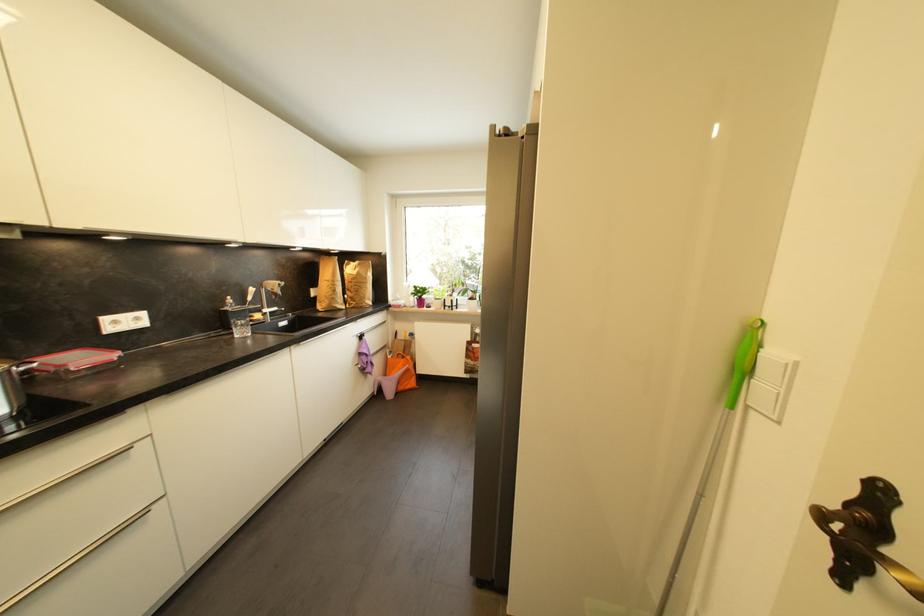
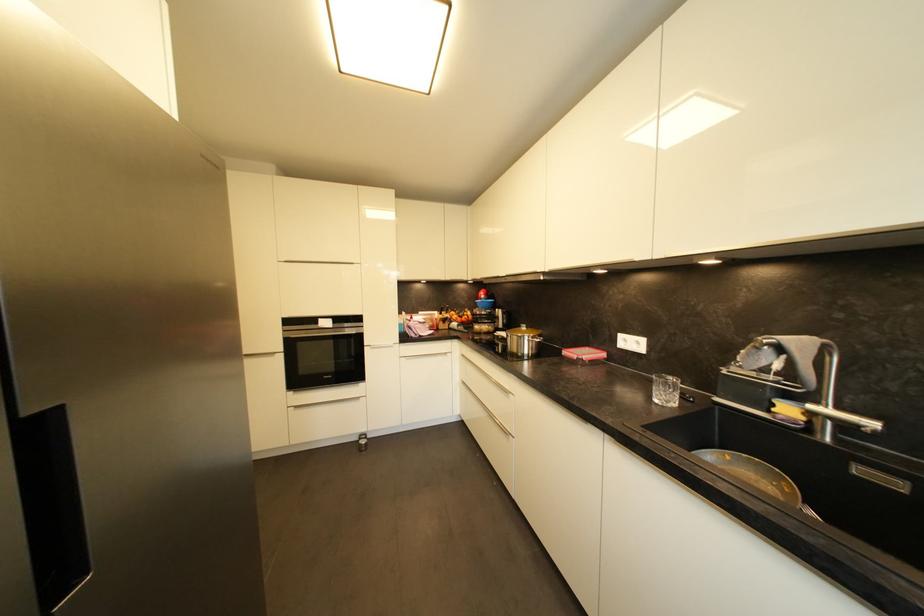
The point at (289, 325) is marked in the first image. Where is the corresponding point in the second image?

(904, 487)